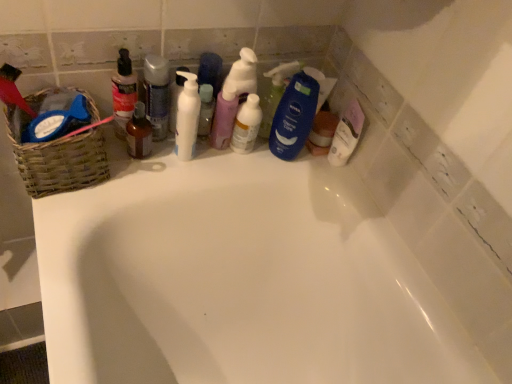
Locate an element on the screen. The image size is (512, 384). free location to the right of pastel pink pump bottle at center, the 3th cleaning product when ordered from right to left is located at coordinates (275, 159).